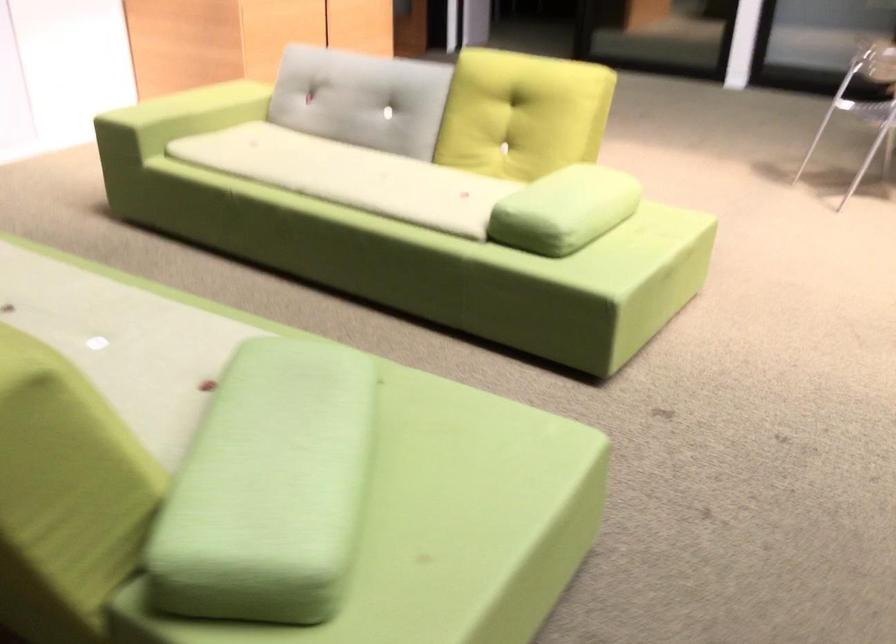
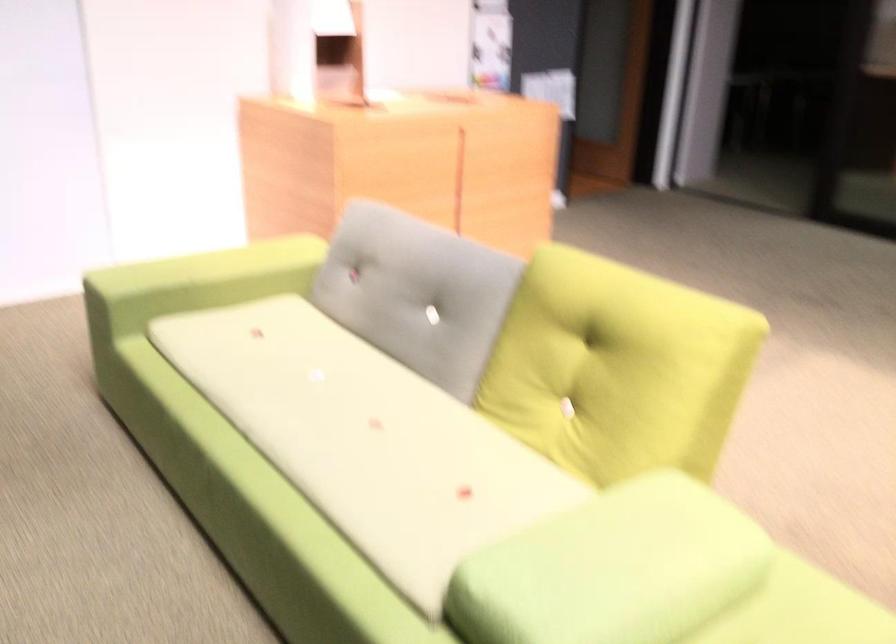
In the second image, find the point that corresponds to the point at 573,194 in the first image.

(613, 569)